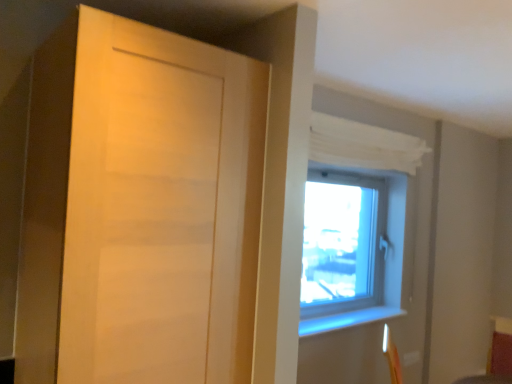
Question: Considering the positions of white sheer curtain at upper right and matte wood door at left in the image, is white sheer curtain at upper right taller or shorter than matte wood door at left?

Choices:
 (A) tall
 (B) short

Answer: (B)

Question: In the image, is white sheer curtain at upper right positioned in front of or behind matte wood door at left?

Choices:
 (A) front
 (B) behind

Answer: (B)

Question: Is white sheer curtain at upper right inside the boundaries of matte wood door at left, or outside?

Choices:
 (A) inside
 (B) outside

Answer: (B)

Question: From the image's perspective, is matte wood door at left above or below white sheer curtain at upper right?

Choices:
 (A) below
 (B) above

Answer: (A)

Question: Is matte wood door at left situated inside white sheer curtain at upper right or outside?

Choices:
 (A) inside
 (B) outside

Answer: (B)

Question: Considering the positions of matte wood door at left and white sheer curtain at upper right in the image, is matte wood door at left taller or shorter than white sheer curtain at upper right?

Choices:
 (A) tall
 (B) short

Answer: (A)

Question: From a real-world perspective, is matte wood door at left physically located above or below white sheer curtain at upper right?

Choices:
 (A) above
 (B) below

Answer: (B)